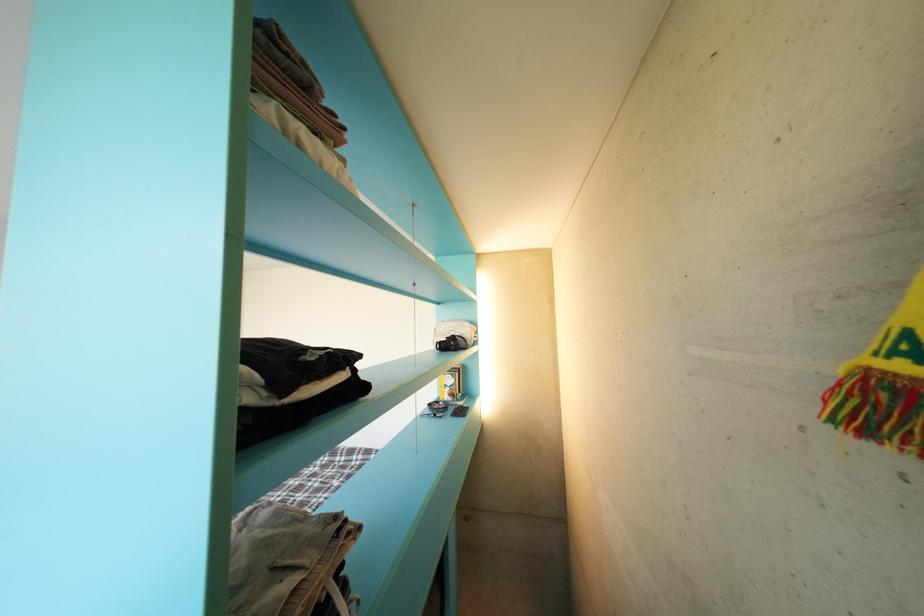
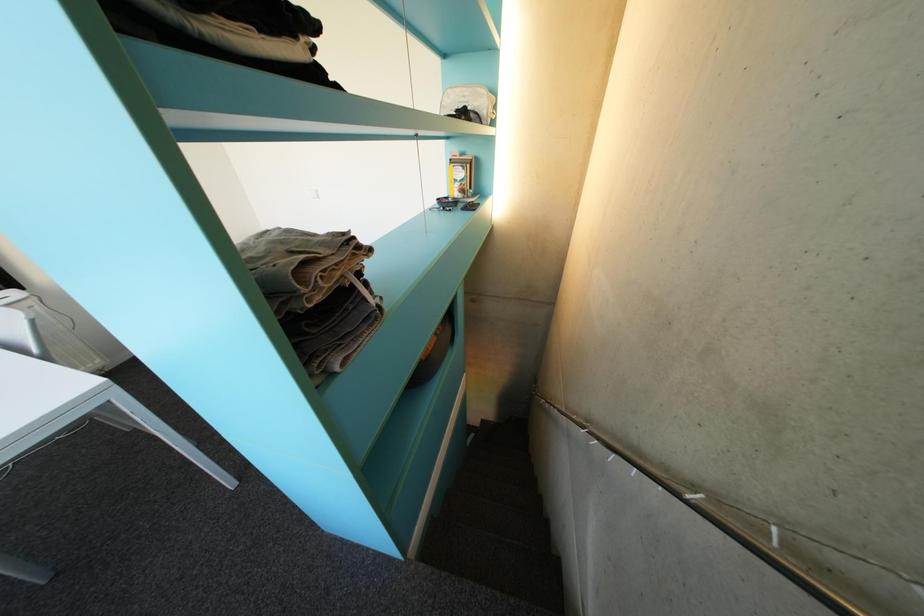
Question: Based on the continuous images, in which direction is the camera rotating? Reply with the corresponding letter.

Choices:
 (A) Left
 (B) Right
 (C) Up
 (D) Down

Answer: (D)